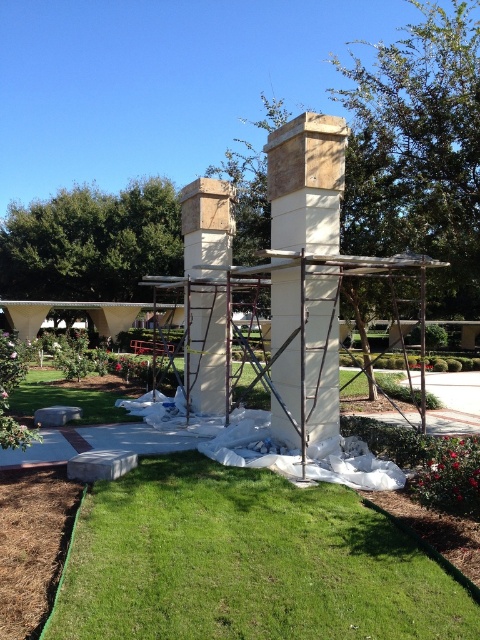
You are standing at the center of the image and want to walk to the paved walkway on the left. Which direction should you move relative to the green grass at lower center?

The green grass at lower center is located at point (247,563), so you should move to the left to reach the paved walkway on the left side of the image.

You are a construction worker standing on the paved walkway to the left. You need to place a heavy tool on the ground that is not covered by the white tarp. Which area should you choose between the green grass at lower center and the beige stone chimney at center?

The green grass at lower center is in front of the beige stone chimney at center, so placing the heavy tool on the green grass at lower center would be better since it is not covered by the white tarp and is accessible. The beige stone chimney at center is likely under the tarp or part of the construction area, making it unsuitable.

You are standing at the camera position and want to reach the beige stone gazebo at center. The path you need to take is straight and unobstructed. If your walking speed is 1.2 meters per second, how many seconds will it take you to reach the gazebo?

The distance between you and the beige stone gazebo at center is 10.49 meters. At a walking speed of 1.2 meters per second, it will take approximately 8.74 seconds to reach the gazebo.